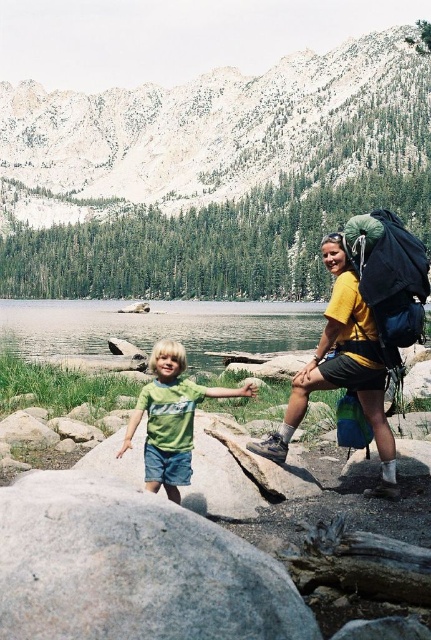
You are planning to take a photo of the snowy granite mountain at upper center and the green matte shirt at center. The camera you have can focus on objects within a 200 meter range. Will both subjects be in focus?

The snowy granite mountain at upper center is 226.41 meters away from the green matte shirt at center. Since the camera can only focus within 200 meters, the mountain is beyond the camera range and will not be in focus.

You are a photographer trying to capture a photo of the snowy granite mountain at upper center and the green matte shirt at center. Which object appears larger in the photo?

The snowy granite mountain at upper center appears larger in the photo because it is taller than the green matte shirt at center.

You are a photographer planning to take a picture of the gray rough boulder at lower left and the yellow matte backpack at right. Since you want both objects in focus, you need to know their vertical positions. Can you tell me which one is lower in the image?

The gray rough boulder at lower left is below the yellow matte backpack at right, so the gray rough boulder at lower left is lower in the image.